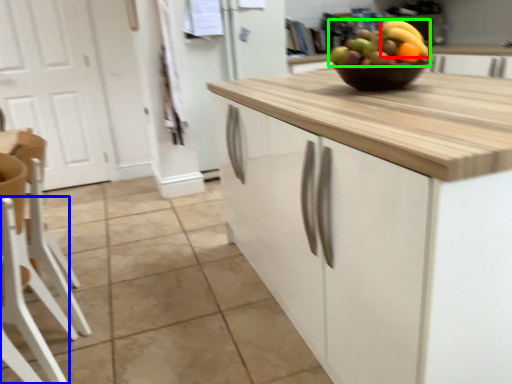
Question: Which object is the closest to the banana (highlighted by a red box)? Choose among these: chair (highlighted by a blue box) or grapefruit (highlighted by a green box).

Choices:
 (A) chair
 (B) grapefruit

Answer: (B)